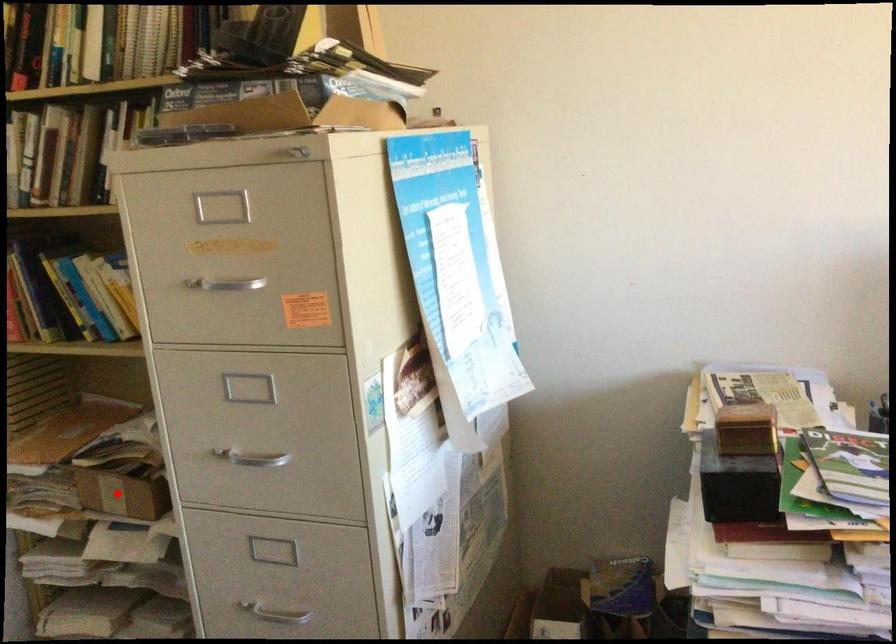
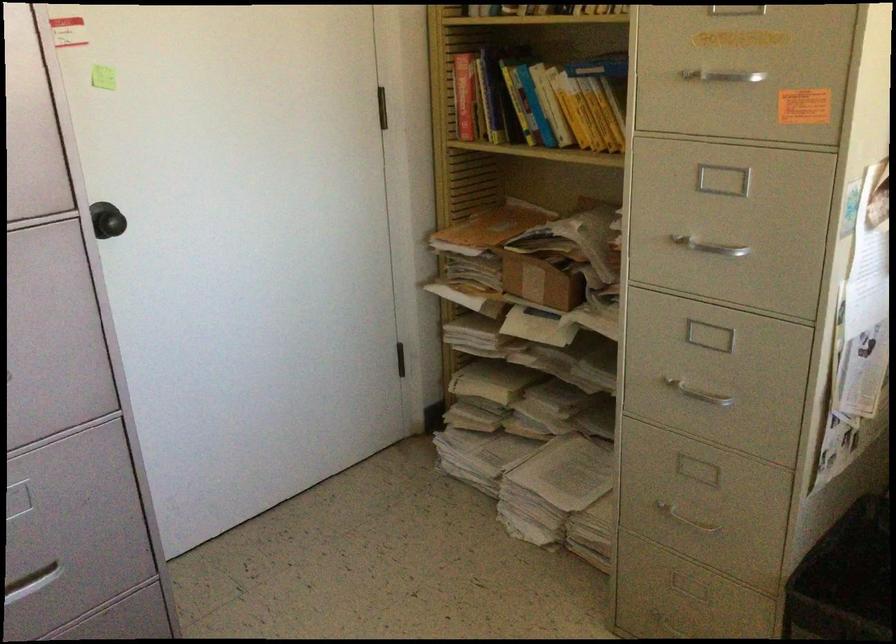
Where in the second image is the point corresponding to the highlighted location from the first image?

(539, 281)